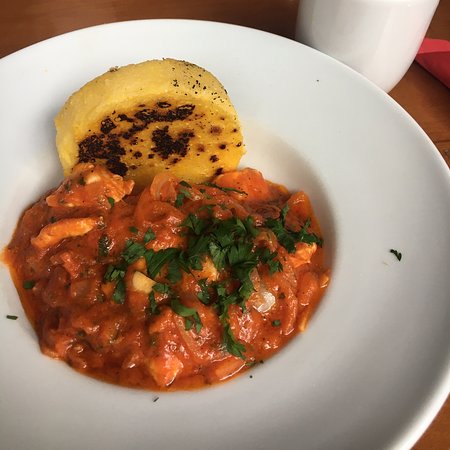
Where is `red napkin`? The height and width of the screenshot is (450, 450). red napkin is located at coordinates (430, 63).